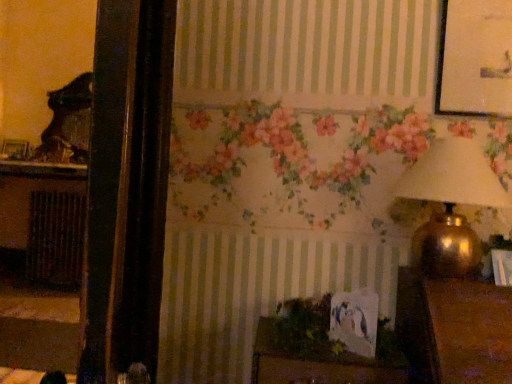
Question: Is green leafy plant at center looking in the opposite direction of brown textured radiator at left?

Choices:
 (A) yes
 (B) no

Answer: (B)

Question: Is green leafy plant at center next to brown textured radiator at left?

Choices:
 (A) yes
 (B) no

Answer: (B)

Question: From a real-world perspective, does green leafy plant at center stand above brown textured radiator at left?

Choices:
 (A) yes
 (B) no

Answer: (A)

Question: Is green leafy plant at center to the left of brown textured radiator at left from the viewer's perspective?

Choices:
 (A) no
 (B) yes

Answer: (A)

Question: Can you confirm if green leafy plant at center is bigger than brown textured radiator at left?

Choices:
 (A) no
 (B) yes

Answer: (A)

Question: From the image's perspective, is green leafy plant at center under brown textured radiator at left?

Choices:
 (A) no
 (B) yes

Answer: (A)

Question: Can you confirm if wooden picture frame at left is thinner than gold metallic lampshade at upper right?

Choices:
 (A) no
 (B) yes

Answer: (B)

Question: Considering the relative positions of wooden picture frame at left and gold metallic lampshade at upper right in the image provided, is wooden picture frame at left to the left of gold metallic lampshade at upper right from the viewer's perspective?

Choices:
 (A) yes
 (B) no

Answer: (A)

Question: Considering the relative positions of wooden picture frame at left and gold metallic lampshade at upper right in the image provided, is wooden picture frame at left behind gold metallic lampshade at upper right?

Choices:
 (A) yes
 (B) no

Answer: (A)

Question: Is wooden picture frame at left smaller than gold metallic lampshade at upper right?

Choices:
 (A) yes
 (B) no

Answer: (A)

Question: Is wooden picture frame at left facing towards gold metallic lampshade at upper right?

Choices:
 (A) no
 (B) yes

Answer: (A)

Question: Considering the relative positions of wooden picture frame at left and gold metallic lampshade at upper right in the image provided, is wooden picture frame at left to the right of gold metallic lampshade at upper right from the viewer's perspective?

Choices:
 (A) no
 (B) yes

Answer: (A)

Question: Would you say brown textured radiator at left is a long distance from green leafy plant at center?

Choices:
 (A) yes
 (B) no

Answer: (A)